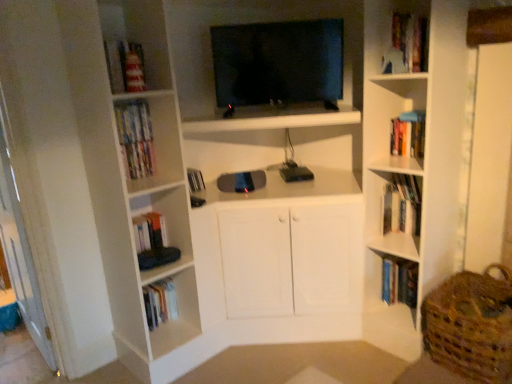
Question: Is hardcover books at upper right, placed as the 4th book when sorted from bottom to top, far from woven brown basket at lower right?

Choices:
 (A) yes
 (B) no

Answer: (B)

Question: Is hardcover books at upper right, placed as the 4th book when sorted from bottom to top, positioned beyond the bounds of woven brown basket at lower right?

Choices:
 (A) yes
 (B) no

Answer: (A)

Question: Can you confirm if hardcover books at upper right, placed as the 4th book when sorted from bottom to top, is bigger than woven brown basket at lower right?

Choices:
 (A) yes
 (B) no

Answer: (B)

Question: Is hardcover books at upper right, the 2th book when ordered from top to bottom, wider than woven brown basket at lower right?

Choices:
 (A) no
 (B) yes

Answer: (A)

Question: Considering the relative sizes of hardcover books at upper right, placed as the 4th book when sorted from bottom to top, and woven brown basket at lower right in the image provided, is hardcover books at upper right, placed as the 4th book when sorted from bottom to top, smaller than woven brown basket at lower right?

Choices:
 (A) no
 (B) yes

Answer: (B)

Question: From the image's perspective, is matte plastic bookshelf at upper left, positioned as the first book in top-to-bottom order, located above or below hardcover book at upper right, which is the 3th book in bottom-to-top order?

Choices:
 (A) below
 (B) above

Answer: (B)

Question: Would you say matte plastic bookshelf at upper left, the first book in the left-to-right sequence, is to the left or to the right of hardcover book at upper right, placed as the third book when sorted from top to bottom, in the picture?

Choices:
 (A) right
 (B) left

Answer: (B)

Question: In terms of height, does matte plastic bookshelf at upper left, the first book in the left-to-right sequence, look taller or shorter compared to hardcover book at upper right, which is the 3th book in bottom-to-top order?

Choices:
 (A) short
 (B) tall

Answer: (A)

Question: Is point (124, 109) closer or farther from the camera than point (403, 175)?

Choices:
 (A) closer
 (B) farther

Answer: (A)

Question: From their relative heights in the image, would you say white matte book at upper right, the fourth book viewed from the top, is taller or shorter than hardcover book at upper right, placed as the third book when sorted from top to bottom?

Choices:
 (A) short
 (B) tall

Answer: (B)

Question: Is point (414, 203) positioned closer to the camera than point (395, 183)?

Choices:
 (A) farther
 (B) closer

Answer: (B)

Question: Considering their positions, is white matte book at upper right, arranged as the fourth book when viewed from the right, located in front of or behind hardcover book at upper right, marked as the second book in a right-to-left arrangement?

Choices:
 (A) front
 (B) behind

Answer: (B)

Question: From a real-world perspective, is white matte book at upper right, which is the 2th book in bottom-to-top order, above or below hardcover book at upper right, placed as the third book when sorted from top to bottom?

Choices:
 (A) below
 (B) above

Answer: (A)

Question: Based on their sizes in the image, would you say black glossy tv at upper center is bigger or smaller than matte plastic bookshelf at upper left, the first book in the left-to-right sequence?

Choices:
 (A) big
 (B) small

Answer: (A)

Question: Looking at their shapes, would you say black glossy tv at upper center is wider or thinner than matte plastic bookshelf at upper left, which appears as the 5th book when viewed from the right?

Choices:
 (A) thin
 (B) wide

Answer: (B)